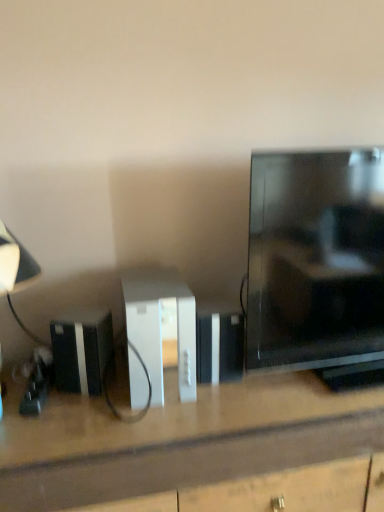
The image size is (384, 512). What are the coordinates of `vacant area situated below black glossy tv at right (from a real-world perspective)` in the screenshot? It's located at (319, 374).